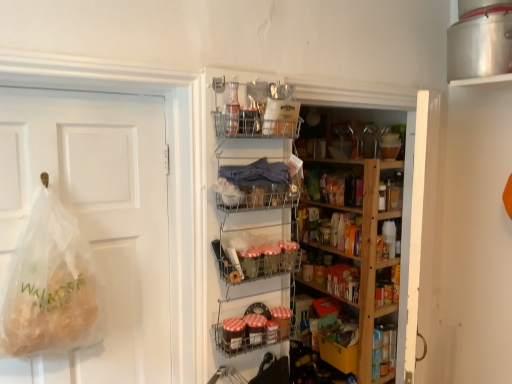
Question: Is metallic wire basket at upper center, the fifth shelf ordered from the bottom, spatially inside translucent plastic bag at left, or outside of it?

Choices:
 (A) outside
 (B) inside

Answer: (A)

Question: Is metallic wire basket at upper center, the 1th shelf in the top-to-bottom sequence, wider or thinner than translucent plastic bag at left?

Choices:
 (A) wide
 (B) thin

Answer: (B)

Question: Based on their relative distances, which object is farther from the metallic wire baskets at lower center, positioned as the first shelf in bottom-to-top order?

Choices:
 (A) metallic wire basket at center, which is counted as the third shelf, starting from the bottom
 (B) metallic wire basket at upper center, the 1th shelf in the top-to-bottom sequence
 (C) metallic wire basket at center, acting as the 4th shelf starting from the bottom
 (D) clear plastic bag at left
 (E) wooden shelves at center, the second shelf in the bottom-to-top sequence

Answer: (E)

Question: Estimate the real-world distances between objects in this image. Which object is closer to the metallic wire basket at upper center, the 1th shelf in the top-to-bottom sequence?

Choices:
 (A) metallic wire basket at center, acting as the 4th shelf starting from the bottom
 (B) metallic wire basket at center, the third shelf viewed from the top
 (C) wooden shelves at center, the fourth shelf in the top-to-bottom sequence
 (D) translucent plastic bag at left
 (E) metallic wire baskets at lower center, positioned as the first shelf in bottom-to-top order

Answer: (A)